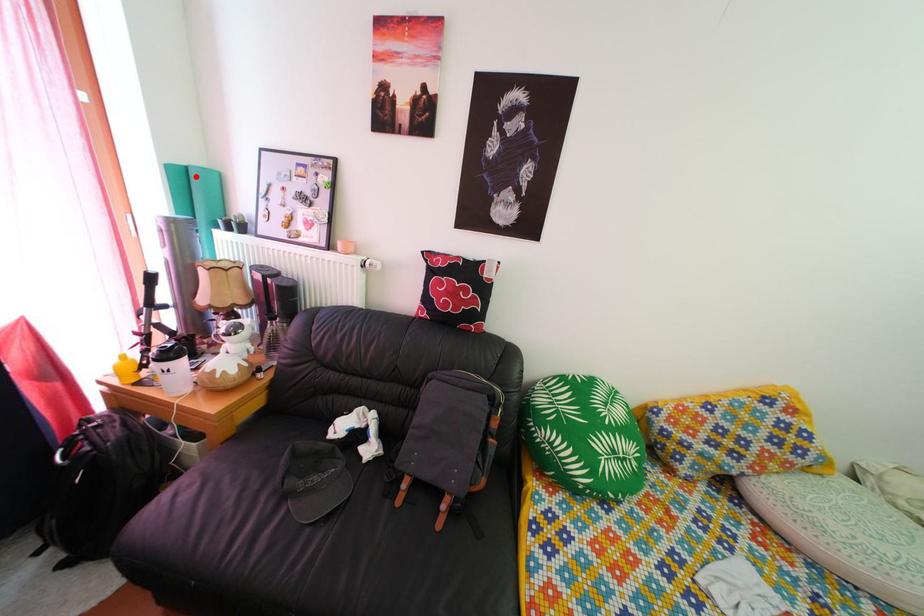
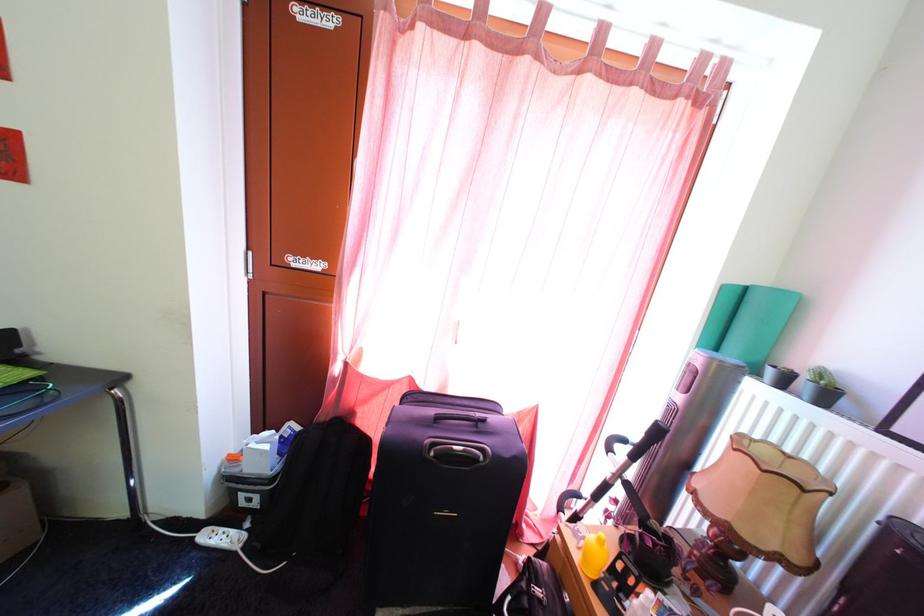
Where in the second image is the point corresponding to the highlighted location from the first image?

(756, 297)